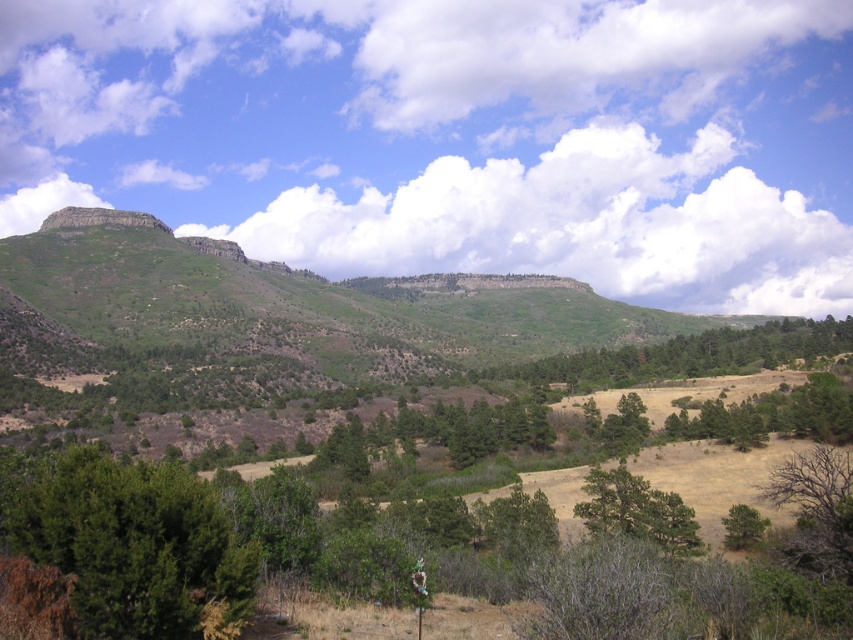
You are standing at the point marked by point [135,547] in the image. What object is located directly in front of you?

The dark green textured tree at lower left is located directly in front of you at point 0.859, 0.159.

You are standing at the base of the dark green textured tree at lower left and want to walk towards the green matte tree at center. Which direction should you head to avoid walking through the tree itself?

The dark green textured tree at lower left is positioned over the green matte tree at center, so you should walk towards the green matte tree at center in a direction that moves away from the overlapping area to avoid walking through the tree itself.